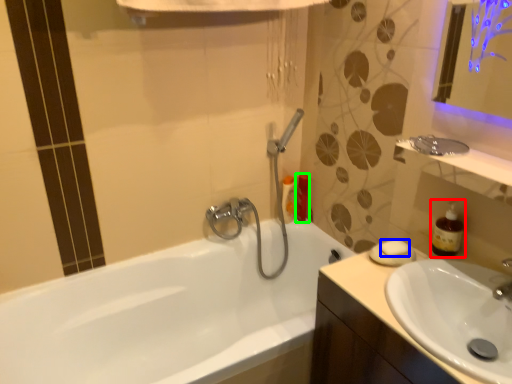
Question: Considering the real-world distances, which object is farthest from soap dispenser (highlighted by a red box)? soap (highlighted by a blue box) or toiletry (highlighted by a green box)?

Choices:
 (A) soap
 (B) toiletry

Answer: (B)